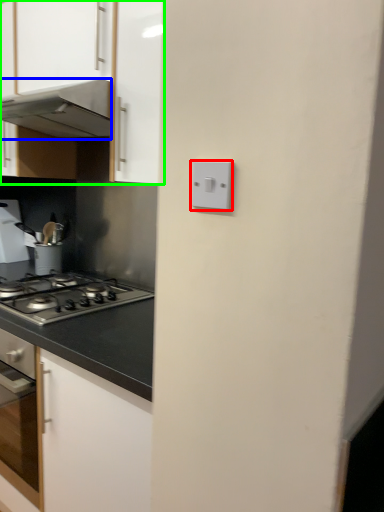
Question: Which is nearer to the light switch (highlighted by a red box)? home appliance (highlighted by a blue box) or cabinetry (highlighted by a green box).

Choices:
 (A) home appliance
 (B) cabinetry

Answer: (B)